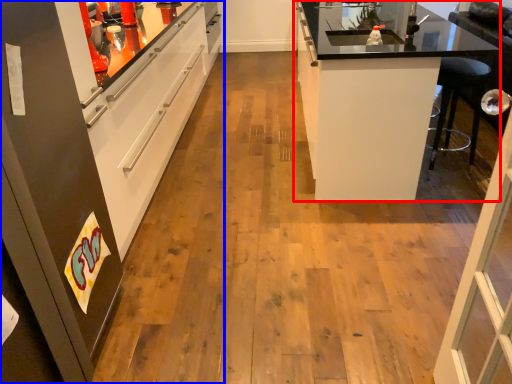
Question: Which of the following is the farthest to the observer, cabinetry (highlighted by a red box) or cabinetry (highlighted by a blue box)?

Choices:
 (A) cabinetry
 (B) cabinetry

Answer: (A)